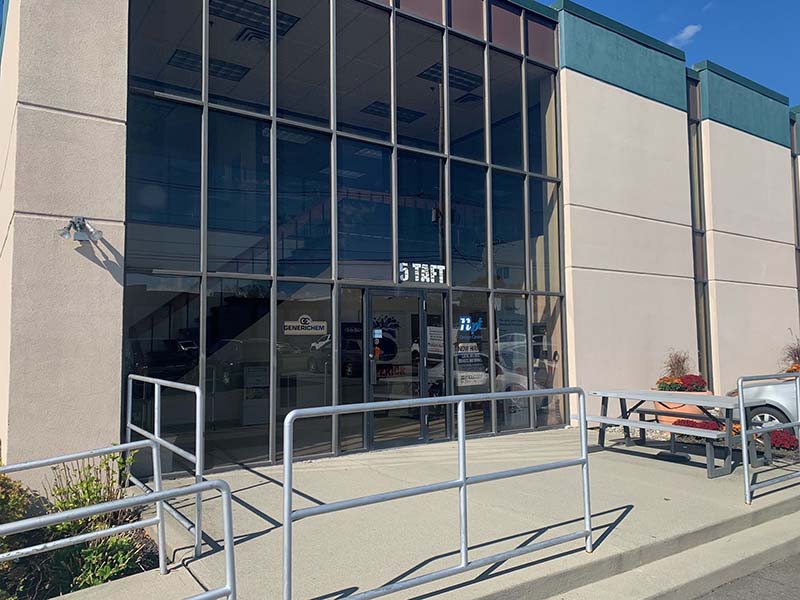
Locate an element on the screen. This screenshot has height=600, width=800. bench is located at coordinates (700, 432).